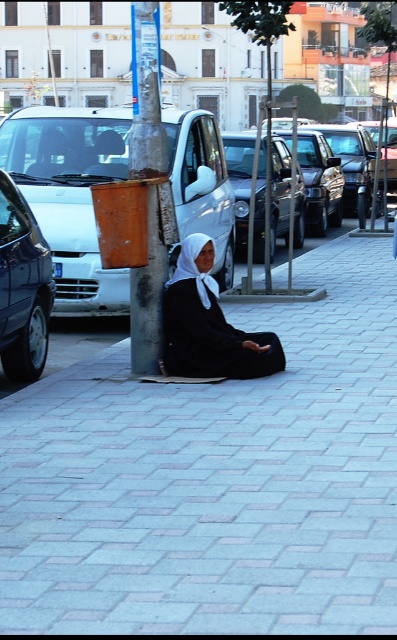
Question: Which object appears farthest from the camera in this image?

Choices:
 (A) black matte dress at center
 (B) white glossy van at left

Answer: (B)

Question: Is white glossy van at left to the left of white fabric headscarf at center from the viewer's perspective?

Choices:
 (A) no
 (B) yes

Answer: (A)

Question: Which object is farther from the camera taking this photo?

Choices:
 (A) gray brick pavement at center
 (B) black matte dress at center

Answer: (B)

Question: Considering the real-world distances, which object is farthest from the shiny silver car at left?

Choices:
 (A) gray brick pavement at center
 (B) white fabric headscarf at center

Answer: (A)

Question: Is white glossy van at left positioned at the back of rusty metal pole at center?

Choices:
 (A) no
 (B) yes

Answer: (B)

Question: Is white glossy van at left to the right of rusty metal pole at center from the viewer's perspective?

Choices:
 (A) no
 (B) yes

Answer: (B)